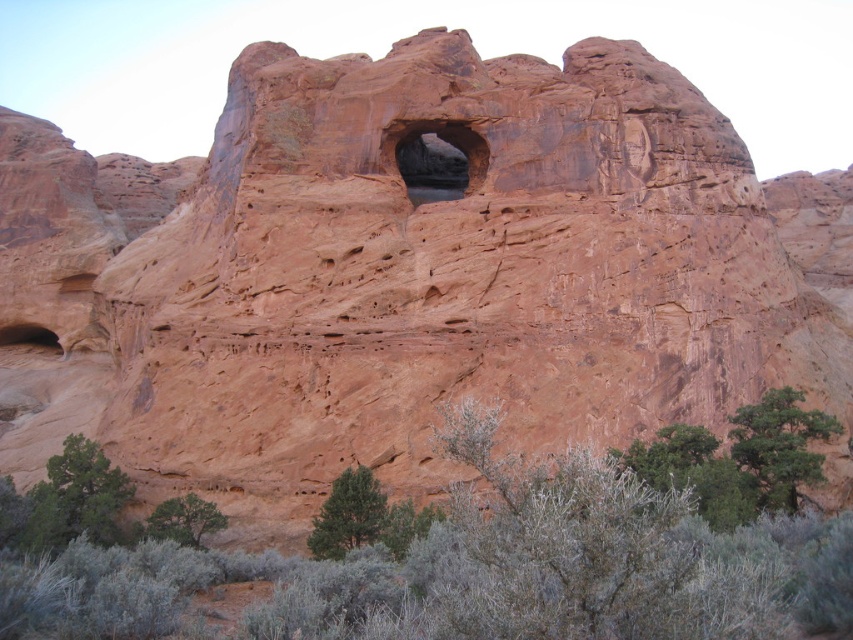
Question: Does green matte tree at lower center lie behind green leafy shrub at lower left?

Choices:
 (A) no
 (B) yes

Answer: (A)

Question: Among these points, which one is farthest from the camera?

Choices:
 (A) (782, 508)
 (B) (418, 132)
 (C) (378, 502)
 (D) (196, 515)

Answer: (B)

Question: Among these points, which one is nearest to the camera?

Choices:
 (A) (821, 432)
 (B) (160, 513)
 (C) (358, 524)
 (D) (595, 522)

Answer: (D)

Question: Can you confirm if green leafy shrubs at lower center is positioned above green matte tree at lower center?

Choices:
 (A) yes
 (B) no

Answer: (A)

Question: Which object is positioned farthest from the green leafy tree at lower right?

Choices:
 (A) green leafy tree at lower left
 (B) smooth sandstone arch at center

Answer: (A)

Question: Is green leafy tree at lower right to the left of green leafy shrub at lower left from the viewer's perspective?

Choices:
 (A) no
 (B) yes

Answer: (A)